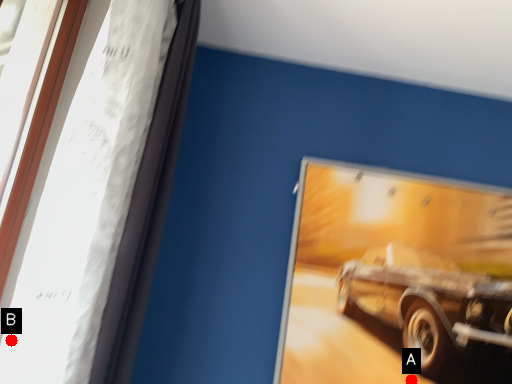
Question: Two points are circled on the image, labeled by A and B beside each circle. Which point appears farthest from the camera in this image?

Choices:
 (A) A is further
 (B) B is further

Answer: (A)